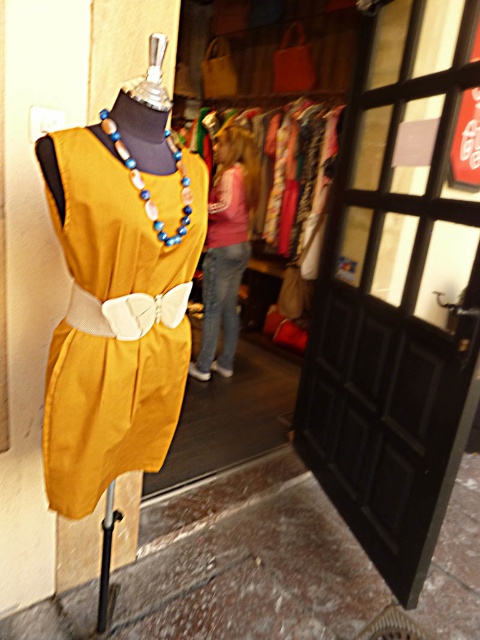
Question: Does matte yellow fabric dress at center appear under blue and white beaded necklace at center?

Choices:
 (A) yes
 (B) no

Answer: (A)

Question: Estimate the real-world distances between objects in this image. Which object is farther from the black wooden door at right?

Choices:
 (A) blue and white beaded necklace at center
 (B) matte yellow fabric dress at center

Answer: (A)

Question: Is black wooden door at right wider than matte yellow fabric dress at center?

Choices:
 (A) yes
 (B) no

Answer: (A)

Question: Which of the following is the farthest from the observer?

Choices:
 (A) matte yellow fabric dress at center
 (B) pink fabric dress at center
 (C) black wooden door at right
 (D) blue and white beaded necklace at center

Answer: (B)

Question: Which point is closer to the camera taking this photo?

Choices:
 (A) (228, 211)
 (B) (164, 132)
 (C) (471, 204)
 (D) (93, 342)

Answer: (B)

Question: Observing the image, what is the correct spatial positioning of black wooden door at right in reference to blue and white beaded necklace at center?

Choices:
 (A) left
 (B) right

Answer: (B)